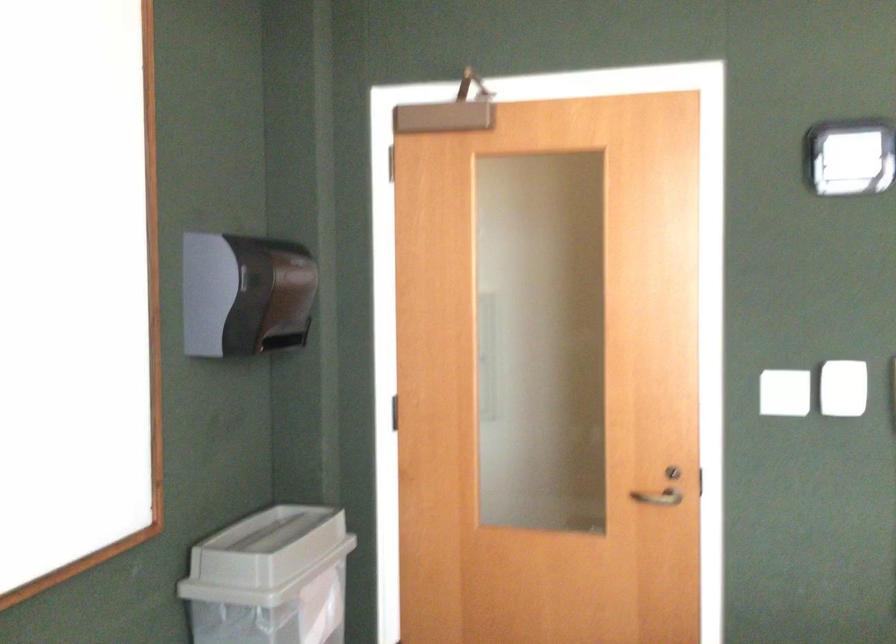
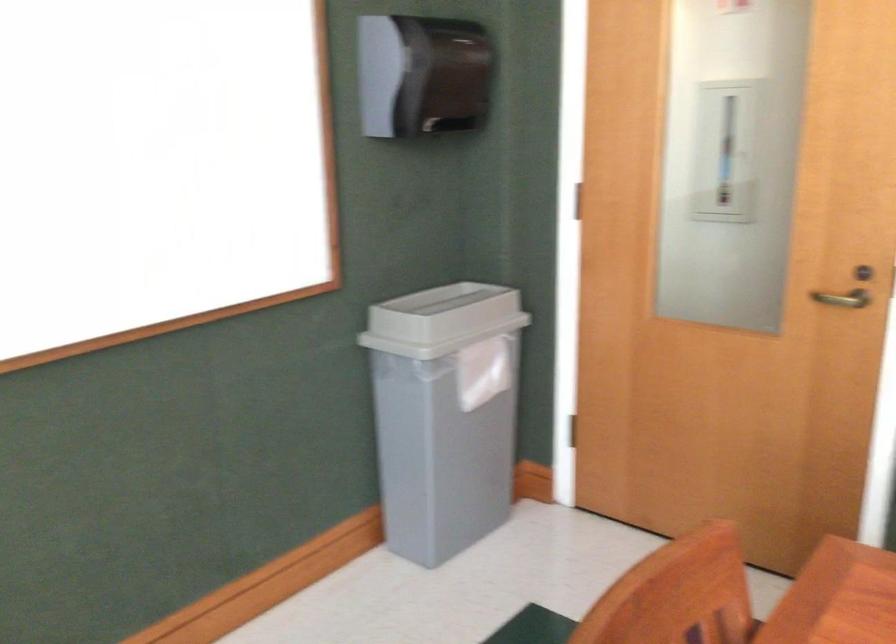
Question: The camera is either moving clockwise (left) or counter-clockwise (right) around the object. The first image is from the beginning of the video and the second image is from the end. Is the camera moving left or right when shooting the video?

Choices:
 (A) Left
 (B) Right

Answer: (B)